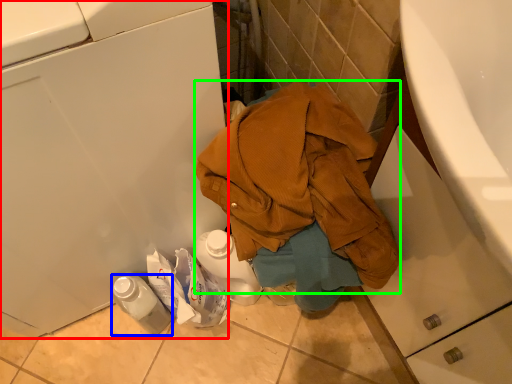
Question: Which object is positioned closest to washing machine (highlighted by a red box)? Select from bottle (highlighted by a blue box) and waste (highlighted by a green box).

Choices:
 (A) bottle
 (B) waste

Answer: (B)